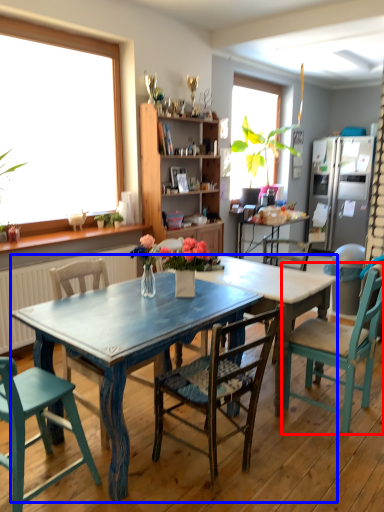
Question: Which point is closer to the camera, chair (highlighted by a red box) or desk (highlighted by a blue box)?

Choices:
 (A) chair
 (B) desk

Answer: (B)